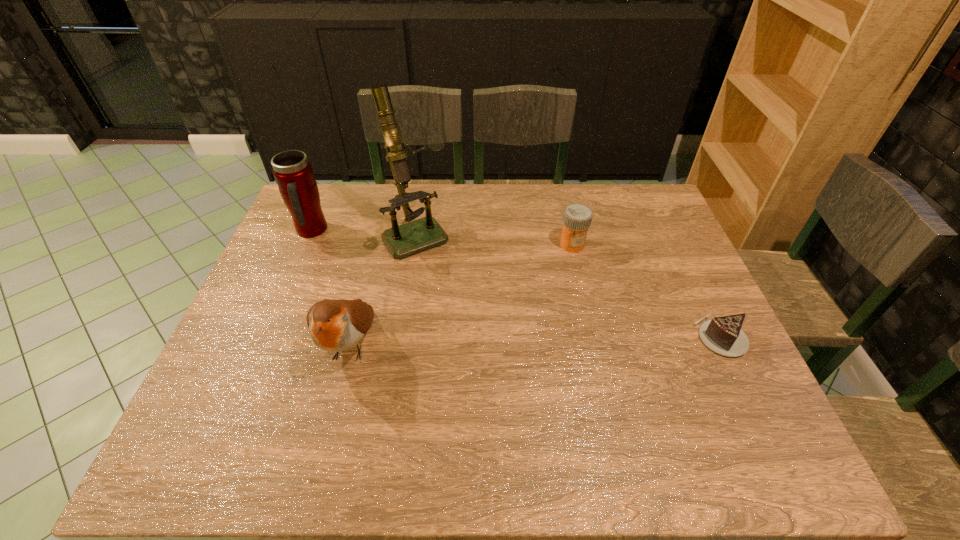
The image size is (960, 540). In order to click on free space at the near right corner of the desktop in this screenshot , I will do `click(693, 400)`.

Identify the location of vacant point located between the rightmost object and the second shortest object. (646, 291).

Image resolution: width=960 pixels, height=540 pixels. I want to click on vacant space that's between the microscope and the bird, so click(x=383, y=289).

This screenshot has width=960, height=540. I want to click on vacant area that lies between the medicine and the rightmost object, so click(646, 291).

The image size is (960, 540). I want to click on empty location between the rightmost object and the fourth object from left to right, so click(x=646, y=291).

This screenshot has width=960, height=540. In order to click on unoccupied position between the tallest object and the rightmost object in this screenshot , I will do `click(568, 286)`.

Locate an element on the screen. empty space between the leftmost object and the bird is located at coordinates (330, 288).

The image size is (960, 540). I want to click on free space between the bird and the thermos bottle, so click(330, 288).

You are a GUI agent. You are given a task and a screenshot of the screen. Output one action in this format:
    pyautogui.click(x=<x>, y=<y>)
    Task: Click on the vacant area that lies between the microscope and the medicine
    This screenshot has width=960, height=540.
    Given the screenshot: What is the action you would take?
    pyautogui.click(x=494, y=240)

Locate an element on the screen. This screenshot has height=540, width=960. vacant space that is in between the medicine and the shortest object is located at coordinates (646, 291).